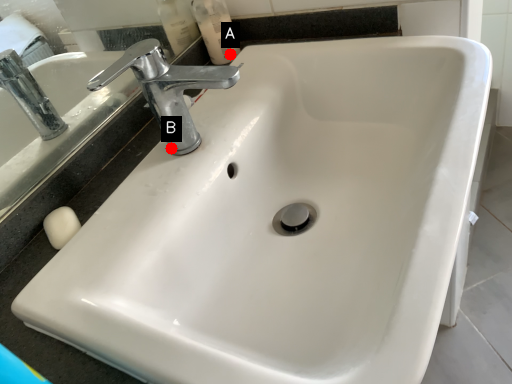
Question: Two points are circled on the image, labeled by A and B beside each circle. Which point is closer to the camera?

Choices:
 (A) A is closer
 (B) B is closer

Answer: (B)